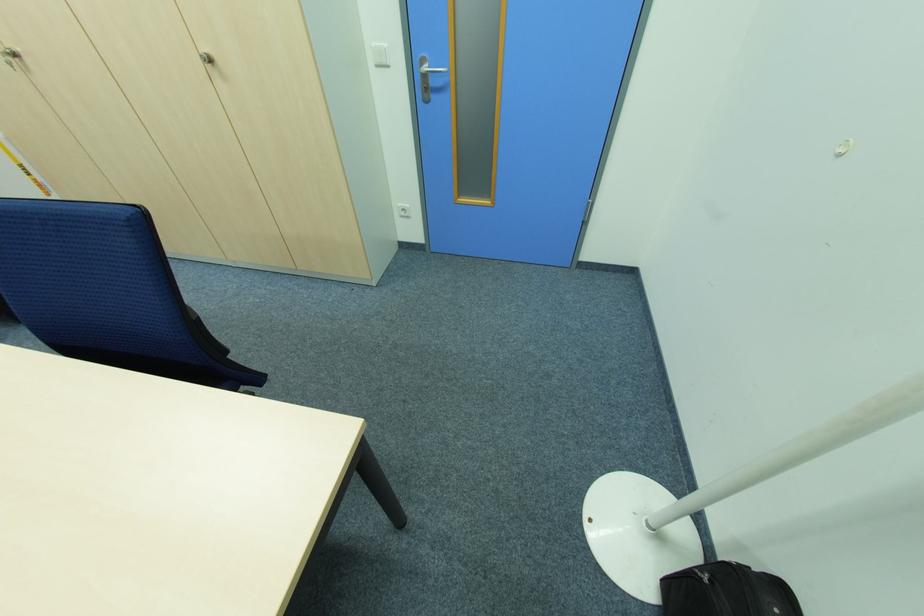
The image size is (924, 616). Identify the location of white light switch. (403, 209).